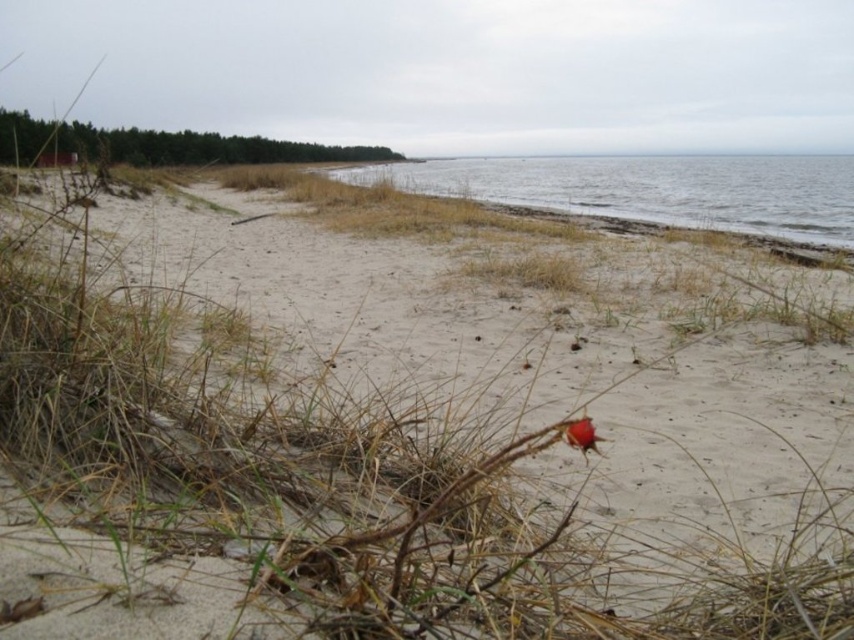
Question: Which point is farther from the camera taking this photo?

Choices:
 (A) (793, 536)
 (B) (791, 173)

Answer: (B)

Question: Is light beige sand at center thinner than clear water at lower right?

Choices:
 (A) yes
 (B) no

Answer: (A)

Question: Which of the following is the farthest from the observer?

Choices:
 (A) light beige sand at center
 (B) clear water at lower right

Answer: (B)

Question: Is light beige sand at center smaller than clear water at lower right?

Choices:
 (A) yes
 (B) no

Answer: (A)

Question: Can you confirm if light beige sand at center is positioned below clear water at lower right?

Choices:
 (A) no
 (B) yes

Answer: (B)